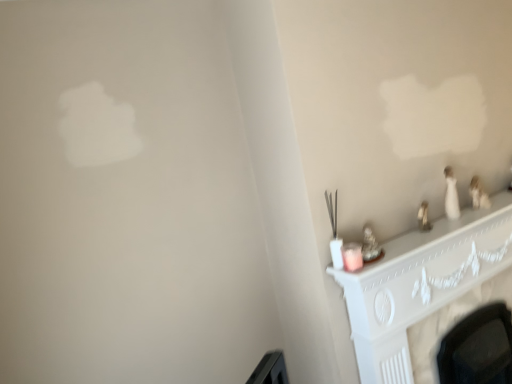
Question: From the image's perspective, is white carved fireplace at lower right above matte white candle at right?

Choices:
 (A) no
 (B) yes

Answer: (A)

Question: Is white carved fireplace at lower right in contact with matte white candle at right?

Choices:
 (A) yes
 (B) no

Answer: (B)

Question: Would you consider white carved fireplace at lower right to be distant from matte white candle at right?

Choices:
 (A) no
 (B) yes

Answer: (A)

Question: Is white carved fireplace at lower right smaller than matte white candle at right?

Choices:
 (A) no
 (B) yes

Answer: (A)

Question: Is white carved fireplace at lower right located outside matte white candle at right?

Choices:
 (A) yes
 (B) no

Answer: (A)

Question: Is white carved fireplace at lower right oriented towards matte white candle at right?

Choices:
 (A) no
 (B) yes

Answer: (A)

Question: Is matte white candle at right further to the viewer compared to white carved fireplace at lower right?

Choices:
 (A) yes
 (B) no

Answer: (B)

Question: Does matte white candle at right have a lesser width compared to white carved fireplace at lower right?

Choices:
 (A) yes
 (B) no

Answer: (A)

Question: Would you say matte white candle at right is outside white carved fireplace at lower right?

Choices:
 (A) no
 (B) yes

Answer: (B)

Question: Is white carved fireplace at lower right inside matte white candle at right?

Choices:
 (A) no
 (B) yes

Answer: (A)

Question: From the image's perspective, is matte white candle at right located beneath white carved fireplace at lower right?

Choices:
 (A) no
 (B) yes

Answer: (A)

Question: Does matte white candle at right have a greater height compared to white carved fireplace at lower right?

Choices:
 (A) no
 (B) yes

Answer: (A)

Question: From the image's perspective, relative to matte white candle at right, is white carved fireplace at lower right above or below?

Choices:
 (A) below
 (B) above

Answer: (A)